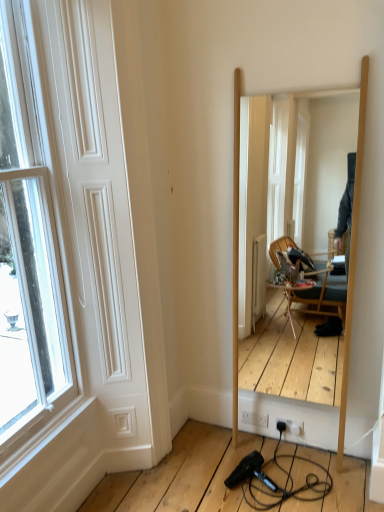
Question: Should I look upward or downward to see wooden mirror at center?

Choices:
 (A) down
 (B) up

Answer: (A)

Question: From a real-world perspective, is white matte door at left beneath wooden mirror at center?

Choices:
 (A) yes
 (B) no

Answer: (B)

Question: From the image's perspective, is white matte door at left on top of wooden mirror at center?

Choices:
 (A) yes
 (B) no

Answer: (B)

Question: Is white matte door at left beside wooden mirror at center?

Choices:
 (A) no
 (B) yes

Answer: (A)

Question: Does white matte door at left come behind wooden mirror at center?

Choices:
 (A) yes
 (B) no

Answer: (B)

Question: Can wooden mirror at center be found inside white matte door at left?

Choices:
 (A) no
 (B) yes

Answer: (A)

Question: From a real-world perspective, is white matte door at left positioned over wooden mirror at center based on gravity?

Choices:
 (A) no
 (B) yes

Answer: (B)

Question: Could you tell me if black plastic hair dryer at lower center is facing wooden mirror at center?

Choices:
 (A) yes
 (B) no

Answer: (B)

Question: Does black plastic hair dryer at lower center have a greater height compared to wooden mirror at center?

Choices:
 (A) no
 (B) yes

Answer: (A)

Question: From the image's perspective, is black plastic hair dryer at lower center located above wooden mirror at center?

Choices:
 (A) yes
 (B) no

Answer: (B)

Question: Considering the relative sizes of black plastic hair dryer at lower center and wooden mirror at center in the image provided, is black plastic hair dryer at lower center thinner than wooden mirror at center?

Choices:
 (A) yes
 (B) no

Answer: (B)

Question: From a real-world perspective, is black plastic hair dryer at lower center located beneath wooden mirror at center?

Choices:
 (A) yes
 (B) no

Answer: (A)

Question: Is black plastic hair dryer at lower center at the left side of wooden mirror at center?

Choices:
 (A) yes
 (B) no

Answer: (A)

Question: Is the depth of wooden mirror at center greater than that of white matte door at left?

Choices:
 (A) yes
 (B) no

Answer: (A)